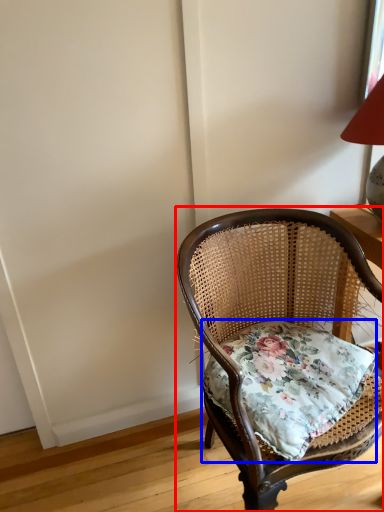
Question: Which object is closer to the camera taking this photo, chair (highlighted by a red box) or pillow (highlighted by a blue box)?

Choices:
 (A) chair
 (B) pillow

Answer: (A)